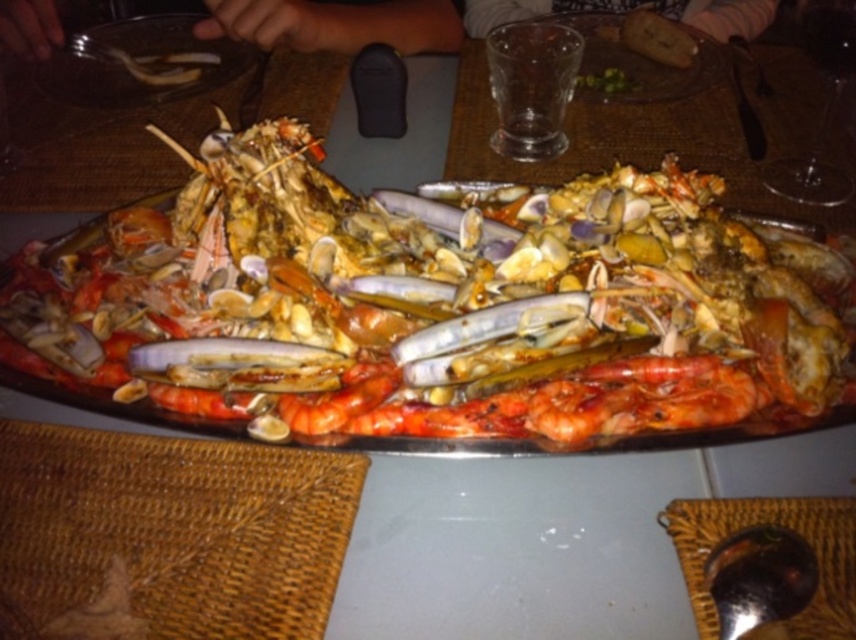
Question: Which object is positioned closest to the shiny red prawn at center?

Choices:
 (A) shiny red prawns at center
 (B) matte glass platter at upper center

Answer: (A)

Question: Which object is positioned farthest from the matte glass platter at upper center?

Choices:
 (A) shiny red prawns at center
 (B) matte glass plate at upper left
 (C) shiny red prawn at center

Answer: (C)

Question: Does shiny red prawns at center lie in front of matte glass plate at upper left?

Choices:
 (A) yes
 (B) no

Answer: (A)

Question: Considering the relative positions of matte glass plate at upper left and matte glass platter at upper center in the image provided, where is matte glass plate at upper left located with respect to matte glass platter at upper center?

Choices:
 (A) right
 (B) left

Answer: (B)

Question: Can you confirm if matte glass plate at upper left is positioned below matte glass platter at upper center?

Choices:
 (A) no
 (B) yes

Answer: (B)

Question: Among these points, which one is nearest to the camera?

Choices:
 (A) click(652, 339)
 (B) click(609, 17)

Answer: (A)